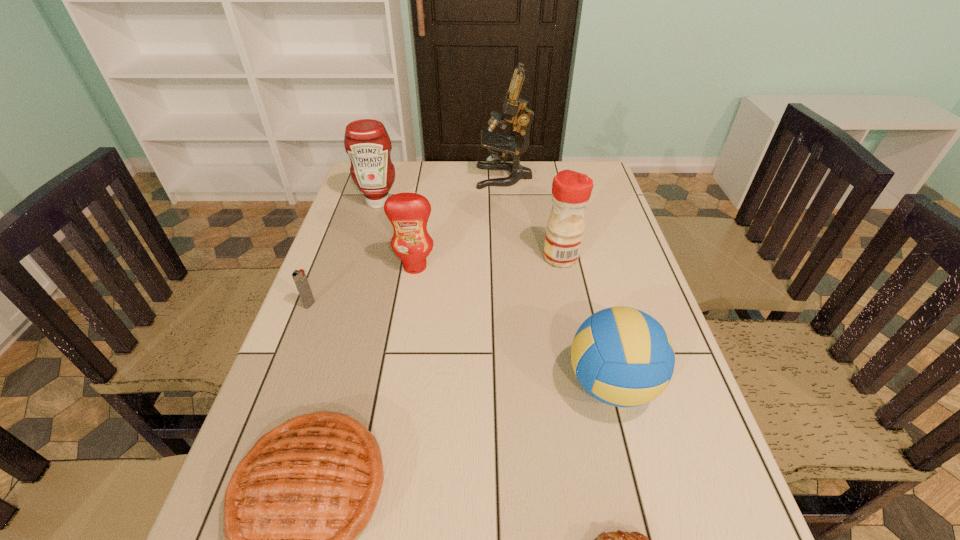
Find the location of `free location located 0.190m at the eyepieces of the tallest object`. free location located 0.190m at the eyepieces of the tallest object is located at coordinates (423, 177).

Locate an element on the screen. vacant area situated 0.390m on the right of the leftmost condiment is located at coordinates (517, 202).

Find the location of a particular element. The height and width of the screenshot is (540, 960). free location located 0.330m on the back of the rightmost condiment is located at coordinates (546, 186).

Find the location of a particular element. This screenshot has width=960, height=540. free space located 0.360m on the label side of the shortest condiment is located at coordinates (395, 390).

Identify the location of vacant space situated 0.130m on the front of the volleyball. Image resolution: width=960 pixels, height=540 pixels. (639, 495).

The height and width of the screenshot is (540, 960). I want to click on vacant region located 0.390m on the right of the fifth farthest object, so 468,305.

Identify the location of microscope that is at the far edge. The image size is (960, 540). (515, 111).

This screenshot has width=960, height=540. Find the location of `condiment at the far edge`. condiment at the far edge is located at coordinates (366, 141).

I want to click on condiment that is at the left edge, so click(x=366, y=141).

Image resolution: width=960 pixels, height=540 pixels. Identify the location of igniter that is at the left edge. (299, 277).